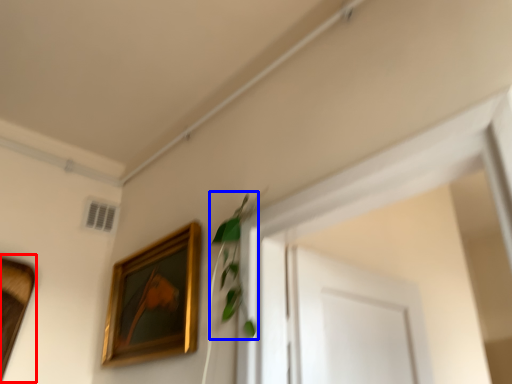
Question: Which object appears closest to the camera in this image, picture frame (highlighted by a red box) or plant (highlighted by a blue box)?

Choices:
 (A) picture frame
 (B) plant

Answer: (B)